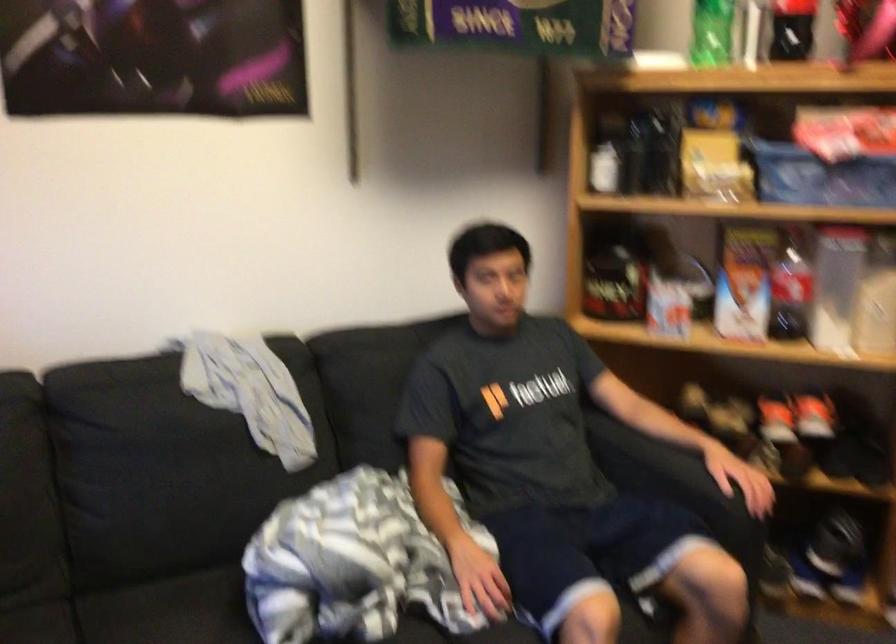
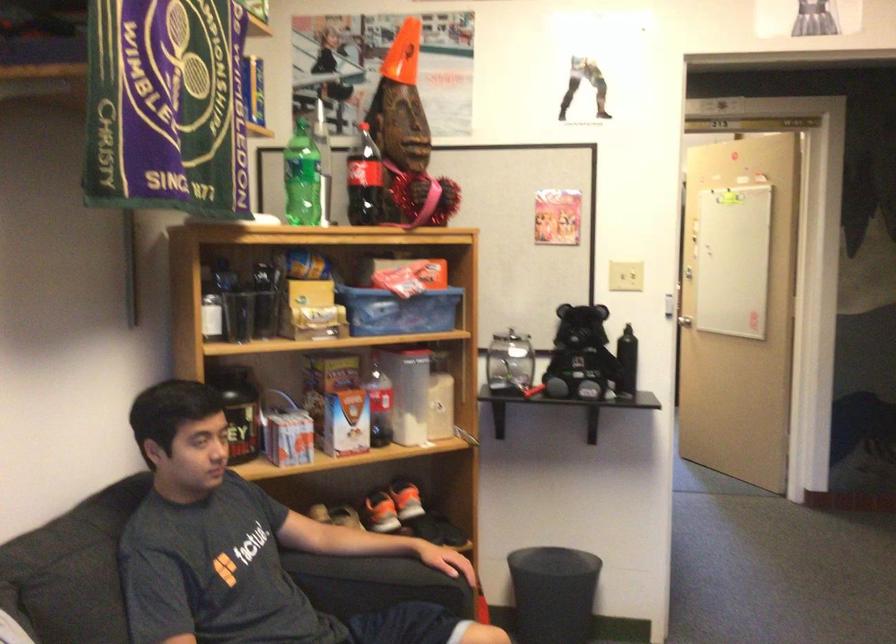
Question: The camera is either moving clockwise (left) or counter-clockwise (right) around the object. The first image is from the beginning of the video and the second image is from the end. Is the camera moving left or right when shooting the video?

Choices:
 (A) Left
 (B) Right

Answer: (A)